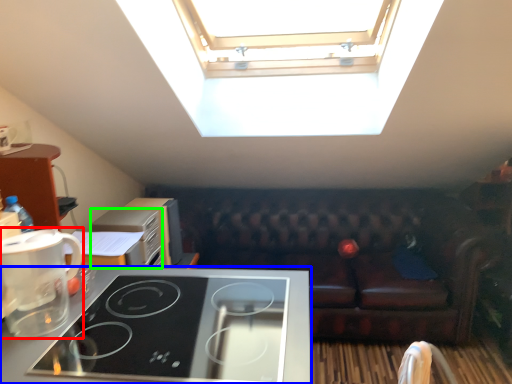
Question: Based on their relative distances, which object is farther from coffee maker (highlighted by a red box)? Choose from home appliance (highlighted by a blue box) and appliance (highlighted by a green box).

Choices:
 (A) home appliance
 (B) appliance

Answer: (B)